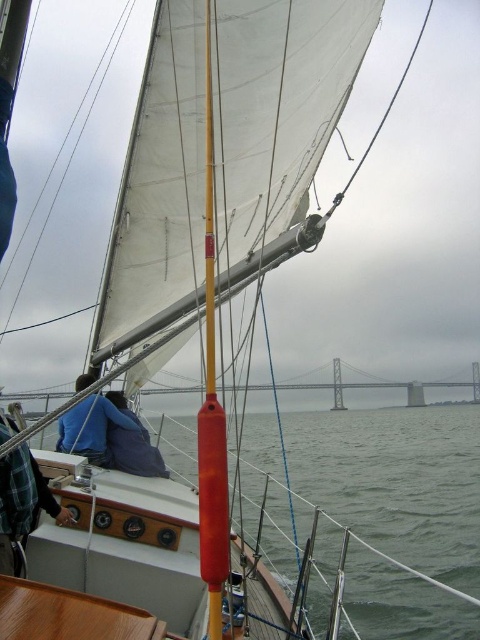
Is smooth orange mast at center to the left of gray concrete bridge at center from the viewer's perspective?

Correct, you'll find smooth orange mast at center to the left of gray concrete bridge at center.

Describe the element at coordinates (212, 403) in the screenshot. The height and width of the screenshot is (640, 480). I see `smooth orange mast at center` at that location.

Does point (226, 468) lie in front of point (479, 385)?

Yes, it is in front of point (479, 385).

This screenshot has width=480, height=640. Find the location of `smooth orange mast at center`. smooth orange mast at center is located at coordinates (212, 403).

Consider the image. Is transparent water at center smaller than smooth orange mast at center?

Actually, transparent water at center might be larger than smooth orange mast at center.

Where is `transparent water at center`? This screenshot has height=640, width=480. transparent water at center is located at coordinates (395, 483).

Between transparent water at center and gray concrete bridge at center, which one has less height?

gray concrete bridge at center is shorter.

Does transparent water at center have a larger size compared to gray concrete bridge at center?

Correct, transparent water at center is larger in size than gray concrete bridge at center.

Between point (424, 413) and point (282, 384), which one is positioned behind?

Positioned behind is point (424, 413).

Where is `transparent water at center`? transparent water at center is located at coordinates (395, 483).